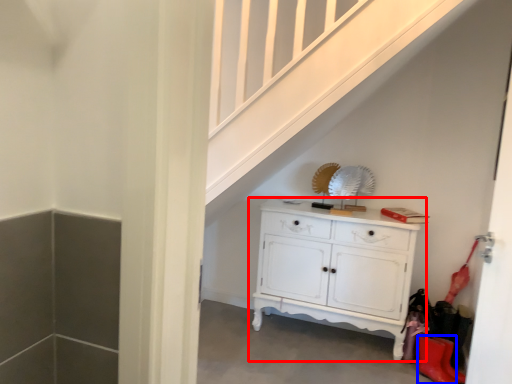
Question: Which point is further to the camera, chest of drawers (highlighted by a red box) or shoe (highlighted by a blue box)?

Choices:
 (A) chest of drawers
 (B) shoe

Answer: (A)